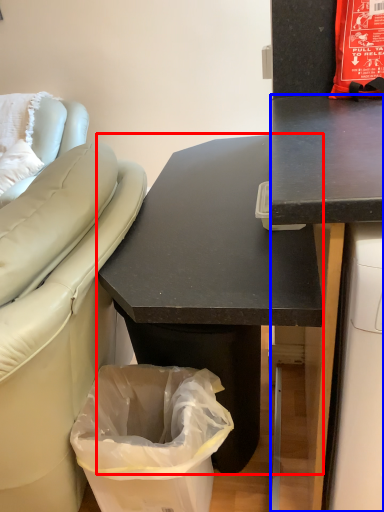
Question: Which object is closer to the camera taking this photo, desk (highlighted by a red box) or desk (highlighted by a blue box)?

Choices:
 (A) desk
 (B) desk

Answer: (B)